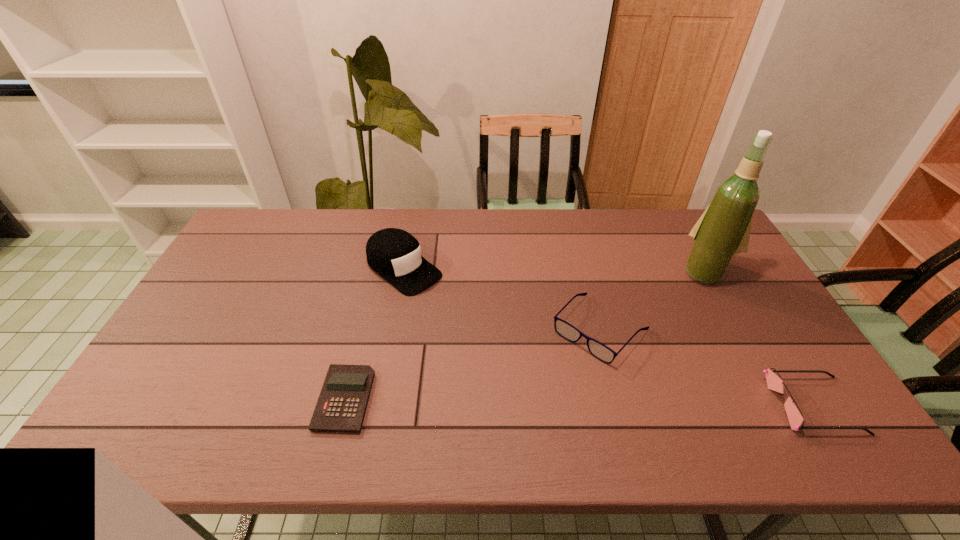
Locate an element on the screen. The image size is (960, 540). object that is at the near right corner is located at coordinates [775, 383].

This screenshot has width=960, height=540. What are the coordinates of `vacant space at the far edge of the desktop` in the screenshot? It's located at (569, 244).

Locate an element on the screen. Image resolution: width=960 pixels, height=540 pixels. free space at the near edge of the desktop is located at coordinates (391, 406).

Image resolution: width=960 pixels, height=540 pixels. Identify the location of vacant space at the left edge of the desktop. point(224,292).

In the image, there is a desktop. Where is `blank space at the near left corner`? This screenshot has height=540, width=960. blank space at the near left corner is located at coordinates (180, 392).

The image size is (960, 540). In order to click on vacant region at the far right corner of the desktop in this screenshot , I will do `click(685, 225)`.

The width and height of the screenshot is (960, 540). What are the coordinates of `vacant point located between the spectacles and the shortest object` in the screenshot? It's located at (472, 364).

The image size is (960, 540). Find the location of `empty space that is in between the shortest object and the sunglasses`. empty space that is in between the shortest object and the sunglasses is located at coordinates (579, 402).

Identify the location of free spot between the third object from left to right and the sunglasses. (707, 367).

This screenshot has width=960, height=540. I want to click on free space between the spectacles and the cap, so tap(502, 299).